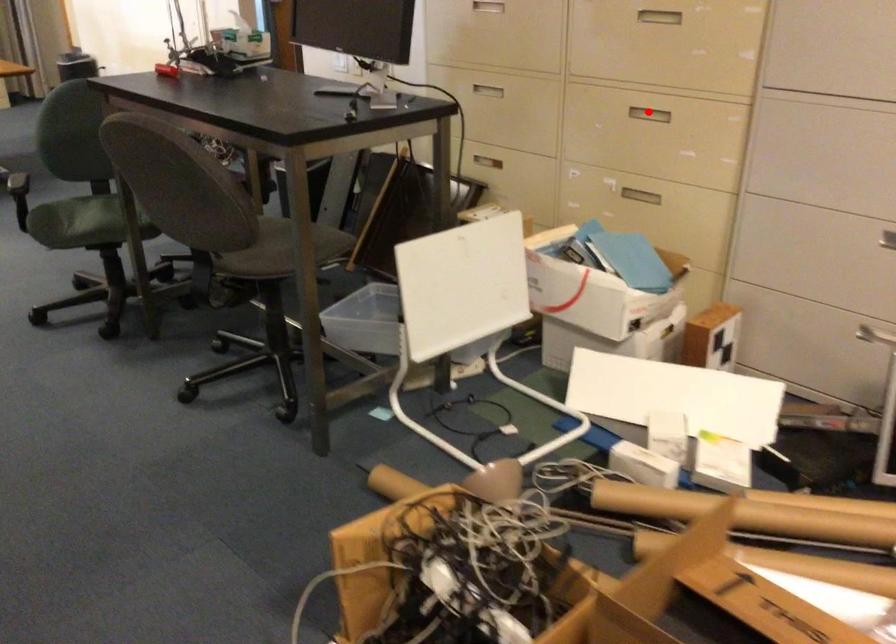
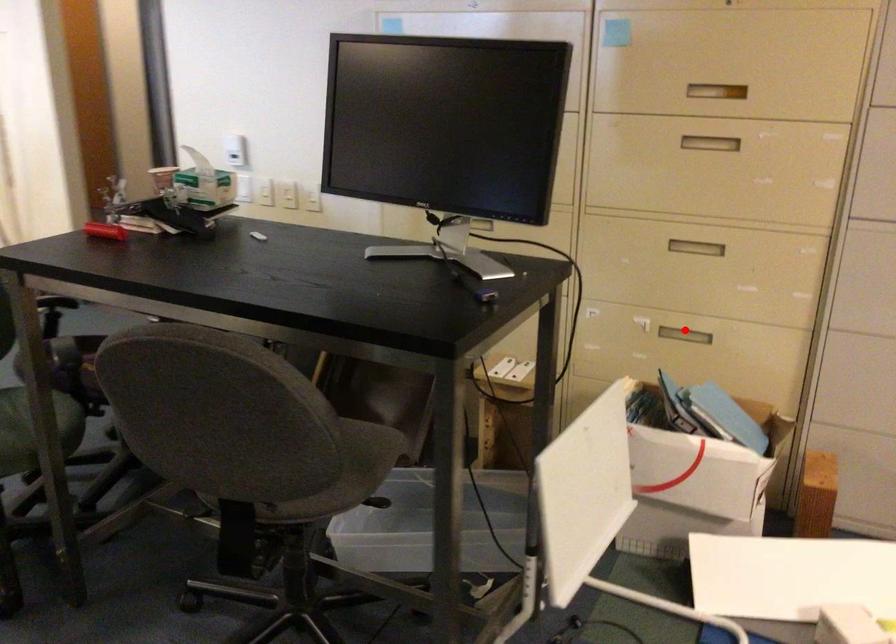
I am providing you with two images of the same scene from different viewpoints. A red point is marked on the first image and another point is marked on the second image. Does the point marked in image1 correspond to the same location as the one in image2?

No